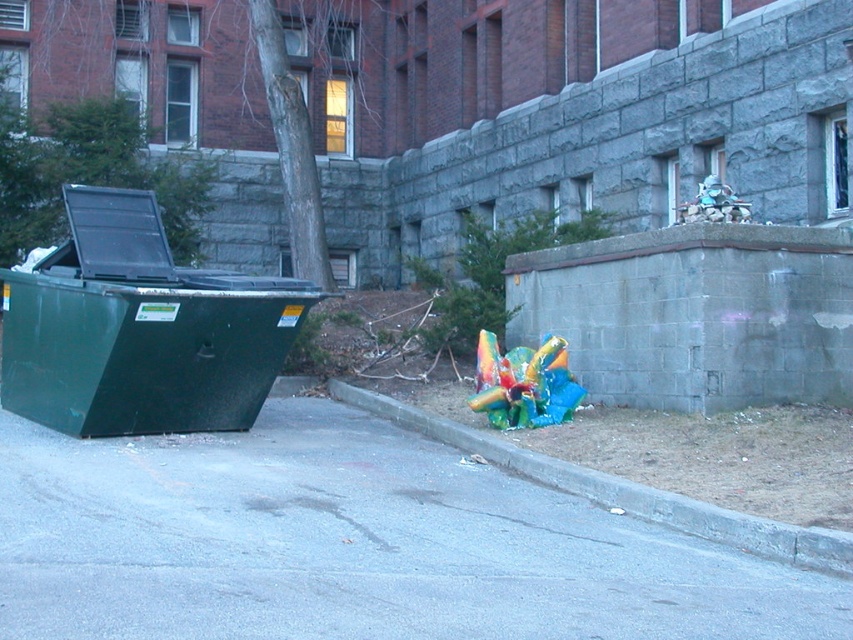
Looking at this image, can you confirm if gray asphalt pavement at lower center is positioned above green matte recycling bin at left?

Incorrect, gray asphalt pavement at lower center is not positioned above green matte recycling bin at left.

Who is more forward, (317, 529) or (241, 288)?

Point (317, 529) is in front.

Find the location of a particular element. The height and width of the screenshot is (640, 853). gray asphalt pavement at lower center is located at coordinates (354, 545).

This screenshot has height=640, width=853. What do you see at coordinates (354, 545) in the screenshot? I see `gray asphalt pavement at lower center` at bounding box center [354, 545].

Is the position of gray asphalt pavement at lower center less distant than that of gray concrete curb at lower right?

Yes, gray asphalt pavement at lower center is closer to the viewer.

Who is more forward, (492, 625) or (701, 534)?

Point (492, 625)

Find the location of `gray asphalt pavement at lower center`. gray asphalt pavement at lower center is located at coordinates (354, 545).

Measure the distance between green matte recycling bin at left and camera.

green matte recycling bin at left is 28.21 feet away from camera.

Can you confirm if green matte recycling bin at left is positioned to the left of gray concrete curb at lower right?

Indeed, green matte recycling bin at left is positioned on the left side of gray concrete curb at lower right.

Is point (173, 301) closer to camera compared to point (712, 504)?

No, it is not.

Locate an element on the screen. The height and width of the screenshot is (640, 853). green matte recycling bin at left is located at coordinates (138, 328).